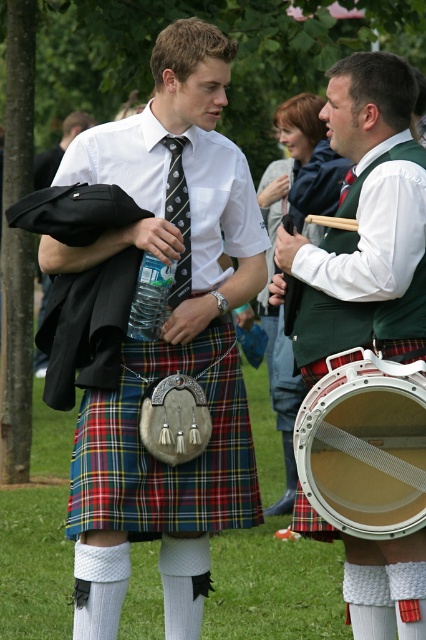
Question: Can you confirm if matte black tie at center is bigger than matte black jacket at left?

Choices:
 (A) yes
 (B) no

Answer: (A)

Question: Which object is farther from the camera taking this photo?

Choices:
 (A) white mesh drum at center
 (B) matte black jacket at left

Answer: (B)

Question: Is white mesh drum at center below black silk tie at center?

Choices:
 (A) no
 (B) yes

Answer: (B)

Question: Which of the following is the farthest from the observer?

Choices:
 (A) matte black tie at center
 (B) white mesh drum at center

Answer: (A)

Question: Is plaid fabric kilt at center thinner than matte black jacket at left?

Choices:
 (A) no
 (B) yes

Answer: (A)

Question: Which point is closer to the camera?

Choices:
 (A) (86, 449)
 (B) (388, 100)

Answer: (B)